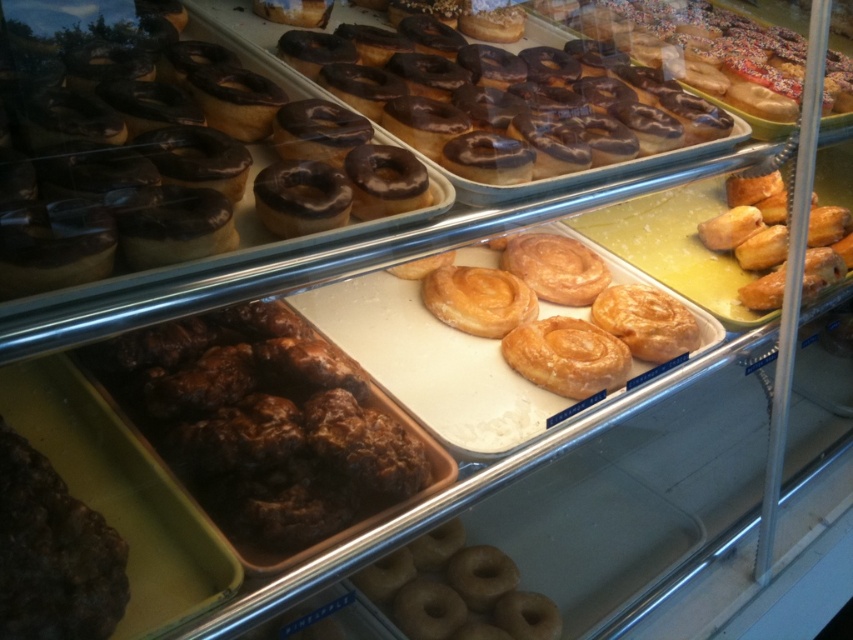
Question: Estimate the real-world distances between objects in this image. Which object is farther from the dark brown crumbly pastry at lower left?

Choices:
 (A) chocolate glazed donuts at upper center
 (B) golden glazed pastry at center

Answer: (A)

Question: Is brown glazed donuts at center to the right of golden crispy pastry at right from the viewer's perspective?

Choices:
 (A) no
 (B) yes

Answer: (A)

Question: Is shiny chocolate donut at upper left to the left of glazed doughnut at center from the viewer's perspective?

Choices:
 (A) no
 (B) yes

Answer: (B)

Question: Which object is positioned farthest from the glazed doughnut at center?

Choices:
 (A) dark brown crumbly pastry at lower left
 (B) brown glazed donuts at center
 (C) chocolate glazed donuts at upper center
 (D) golden crispy pastry at right

Answer: (D)

Question: Which object is the closest to the brown glazed donuts at center?

Choices:
 (A) dark brown crumbly pastry at lower left
 (B) golden glazed pastry at center

Answer: (A)

Question: Is shiny chocolate donut at upper left positioned in front of golden glazed pastry at center?

Choices:
 (A) no
 (B) yes

Answer: (B)